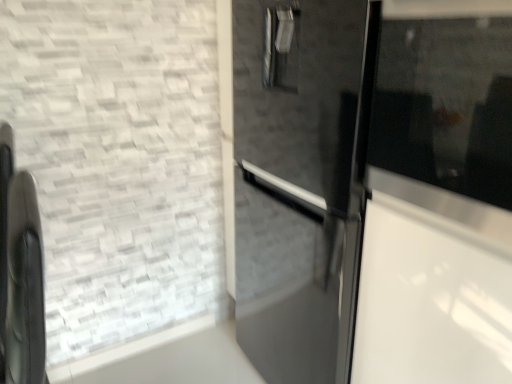
Where is `transparent glass door at right`? The image size is (512, 384). transparent glass door at right is located at coordinates (433, 197).

The width and height of the screenshot is (512, 384). What do you see at coordinates (433, 197) in the screenshot? I see `transparent glass door at right` at bounding box center [433, 197].

What do you see at coordinates (20, 273) in the screenshot?
I see `black matte chair at left` at bounding box center [20, 273].

What is the approximate width of black matte chair at left?

7.63 inches.

The image size is (512, 384). Identify the location of black matte chair at left. (20, 273).

Find the location of a particular element. transparent glass door at right is located at coordinates (433, 197).

Considering the relative positions of transparent glass door at right and black matte chair at left in the image provided, is transparent glass door at right to the right of black matte chair at left from the viewer's perspective?

Correct, you'll find transparent glass door at right to the right of black matte chair at left.

From the picture: Who is more distant, transparent glass door at right or black matte chair at left?

black matte chair at left is further away from the camera.

Is point (446, 266) closer or farther from the camera than point (22, 206)?

Point (446, 266) is positioned closer to the camera compared to point (22, 206).

From the image's perspective, which object appears higher, transparent glass door at right or black matte chair at left?

From the image's view, transparent glass door at right is above.

From a real-world perspective, who is located higher, transparent glass door at right or black matte chair at left?

transparent glass door at right.

From the picture: Considering the sizes of objects transparent glass door at right and black matte chair at left in the image provided, who is wider, transparent glass door at right or black matte chair at left?

transparent glass door at right.

Between transparent glass door at right and black matte chair at left, which one has more height?

black matte chair at left.

Considering the sizes of objects transparent glass door at right and black matte chair at left in the image provided, who is smaller, transparent glass door at right or black matte chair at left?

transparent glass door at right is smaller.

Would you say transparent glass door at right is outside black matte chair at left?

That's correct, transparent glass door at right is outside of black matte chair at left.

Is transparent glass door at right next to black matte chair at left and touching it?

No, transparent glass door at right is not beside black matte chair at left.

Is transparent glass door at right facing towards black matte chair at left?

No, transparent glass door at right is not facing towards black matte chair at left.

At what (x,y) coordinates should I click in order to perform the action: click on glass door above the black matte chair at left (from the image's perspective). Please return your answer as a coordinate pair (x, y). Image resolution: width=512 pixels, height=384 pixels. Looking at the image, I should click on (433, 197).

Which is more to the left, black matte chair at left or transparent glass door at right?

black matte chair at left.

Is black matte chair at left behind transparent glass door at right?

Yes, the depth of black matte chair at left is greater than that of transparent glass door at right.

Considering the positions of point (27, 321) and point (445, 269), is point (27, 321) closer or farther from the camera than point (445, 269)?

Point (27, 321).

From the image's perspective, is black matte chair at left beneath transparent glass door at right?

Indeed, from the image's perspective, black matte chair at left is shown beneath transparent glass door at right.

From a real-world perspective, which object rests below the other?

black matte chair at left.

In terms of width, does black matte chair at left look wider or thinner when compared to transparent glass door at right?

Considering their sizes, black matte chair at left looks slimmer than transparent glass door at right.

In terms of height, does black matte chair at left look taller or shorter compared to transparent glass door at right?

In the image, black matte chair at left appears to be taller than transparent glass door at right.

Who is bigger, black matte chair at left or transparent glass door at right?

black matte chair at left is bigger.

Would you say black matte chair at left contains transparent glass door at right?

No, transparent glass door at right is not inside black matte chair at left.

Is black matte chair at left directly adjacent to transparent glass door at right?

No, black matte chair at left is not with transparent glass door at right.

Is black matte chair at left turned away from transparent glass door at right?

black matte chair at left is not turned away from transparent glass door at right.

What's the angular difference between black matte chair at left and transparent glass door at right's facing directions?

1.13 degrees.

How distant is black matte chair at left from transparent glass door at right?

black matte chair at left and transparent glass door at right are 30.90 inches apart from each other.

Image resolution: width=512 pixels, height=384 pixels. In order to click on glass door that is on the right side of black matte chair at left in this screenshot , I will do `click(433, 197)`.

At what (x,y) coordinates should I click in order to perform the action: click on glass door on the right of black matte chair at left. Please return your answer as a coordinate pair (x, y). This screenshot has width=512, height=384. Looking at the image, I should click on (433, 197).

In the image, there is a black matte chair at left. Identify the location of glass door above it (from the image's perspective). (433, 197).